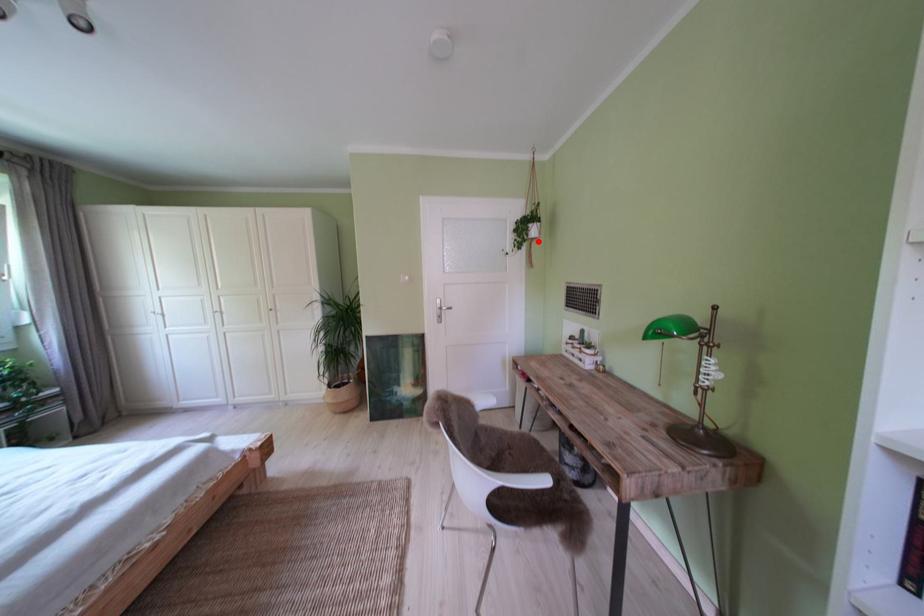
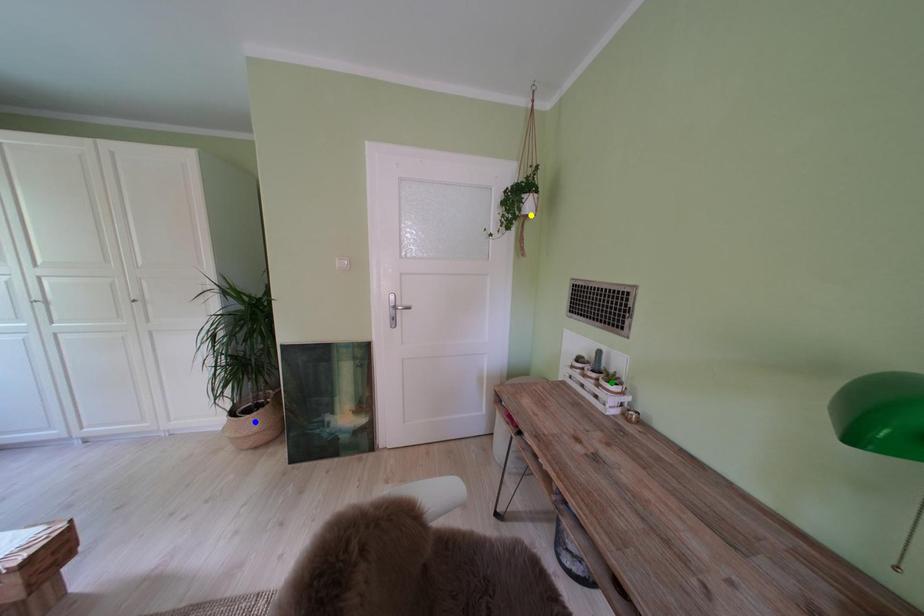
Question: I am providing you with two images of the same scene from different viewpoints. A red point is marked on the first image. You are given multiple points on the second image. Which mark in image 2 goes with the point in image 1?

Choices:
 (A) blue point
 (B) yellow point
 (C) green point

Answer: (B)